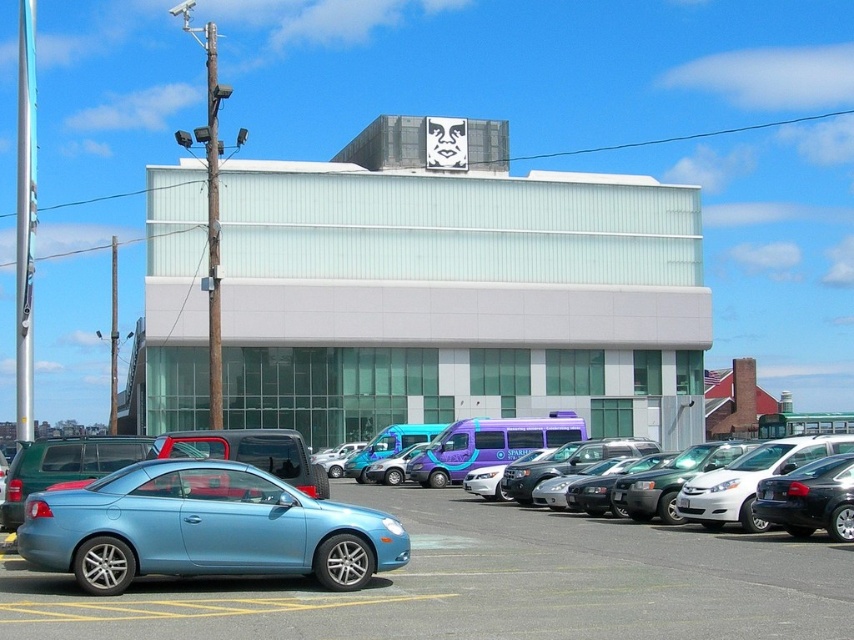
Who is positioned more to the left, light blue car at center-left or light blue metallic car at lower left?

light blue metallic car at lower left is more to the left.

Does point (469, 532) come in front of point (308, 532)?

No, (469, 532) is further to viewer.

The height and width of the screenshot is (640, 854). Identify the location of light blue car at center-left. (483, 586).